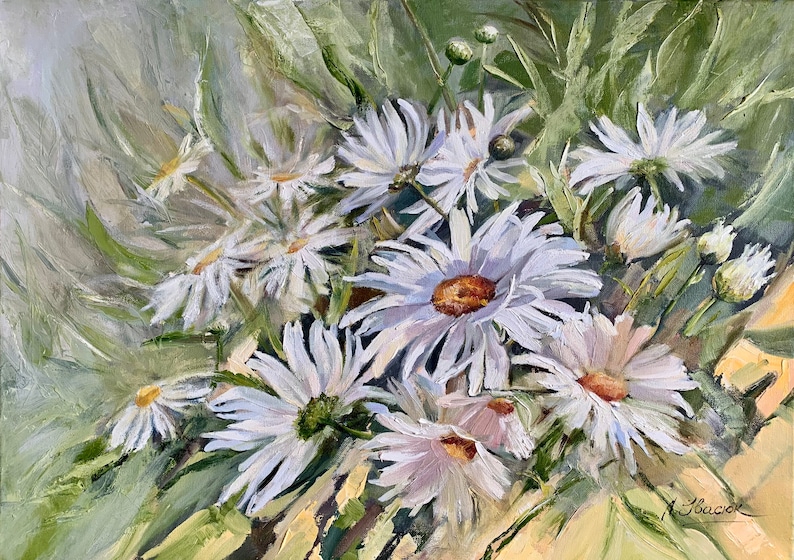
Where is `painting`? painting is located at coordinates (382, 303).